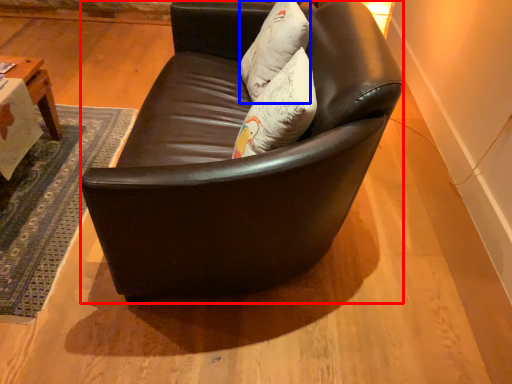
Question: Which of the following is the farthest to the observer, studio couch (highlighted by a red box) or pillow (highlighted by a blue box)?

Choices:
 (A) studio couch
 (B) pillow

Answer: (B)